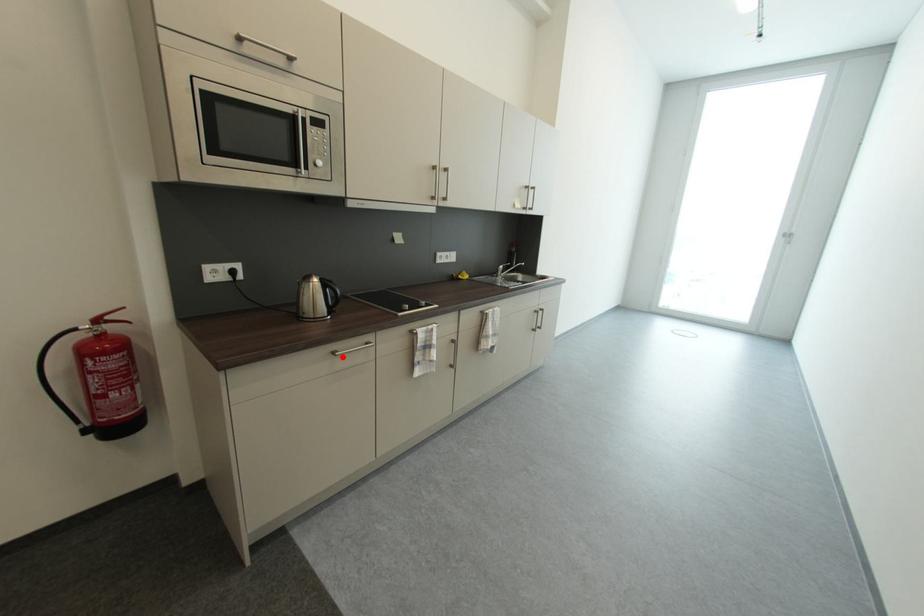
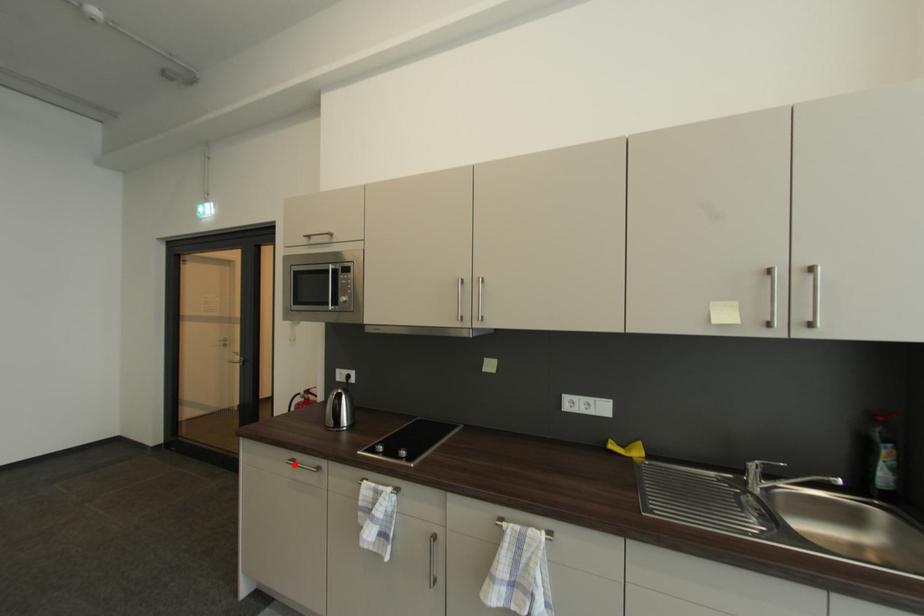
I am providing you with two images of the same scene from different viewpoints. A red point is marked on the first image and another point is marked on the second image. Are the points marked in image1 and image2 representing the same 3D position?

Yes